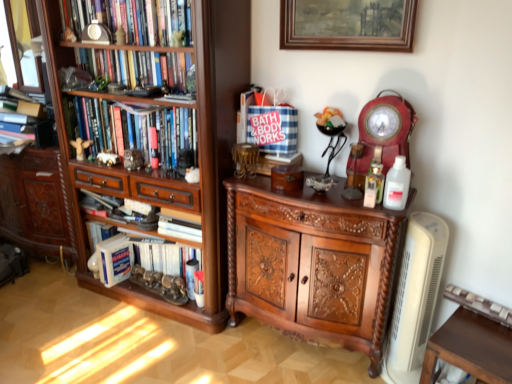
Where is `vacant space situated above brown wooden table at lower right (from a real-world perspective)`? This screenshot has height=384, width=512. vacant space situated above brown wooden table at lower right (from a real-world perspective) is located at coordinates (483, 339).